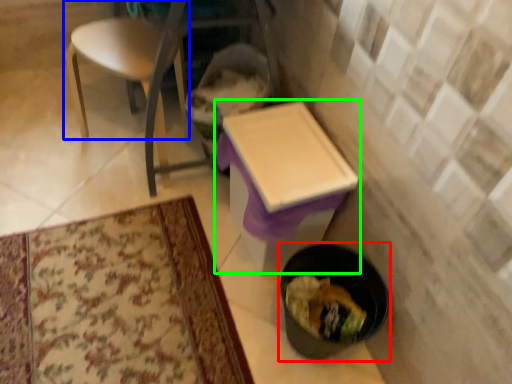
Question: Based on their relative distances, which object is farther from potty (highlighted by a red box)? Choose from chair (highlighted by a blue box) and table (highlighted by a green box).

Choices:
 (A) chair
 (B) table

Answer: (A)